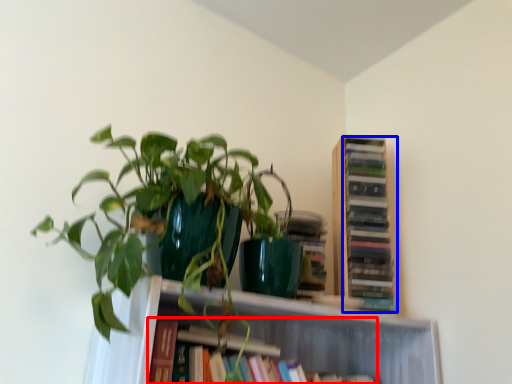
Question: Among these objects, which one is farthest to the camera, book (highlighted by a red box) or book (highlighted by a blue box)?

Choices:
 (A) book
 (B) book

Answer: (B)